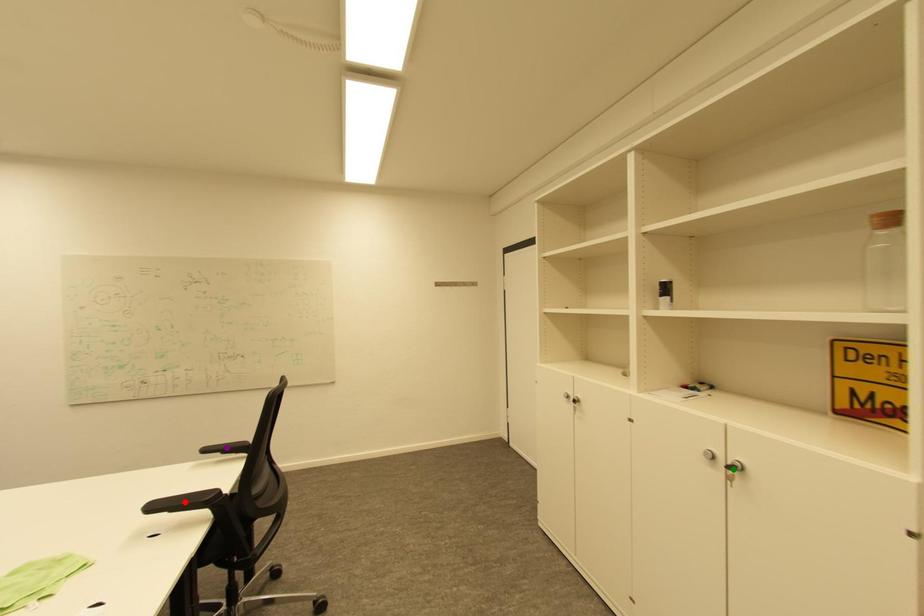
Order these from nearest to farthest:
A) green point
B) purple point
C) red point

1. green point
2. red point
3. purple point